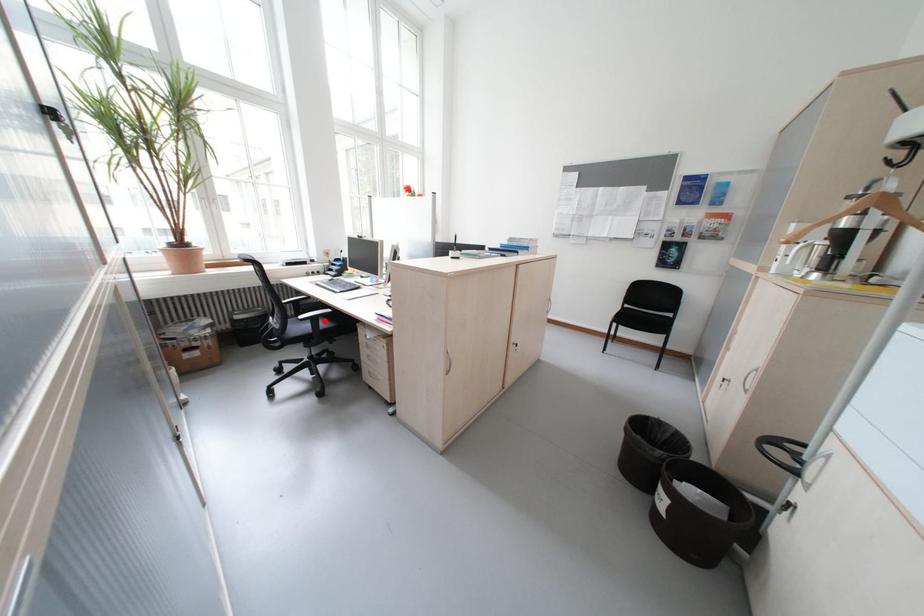
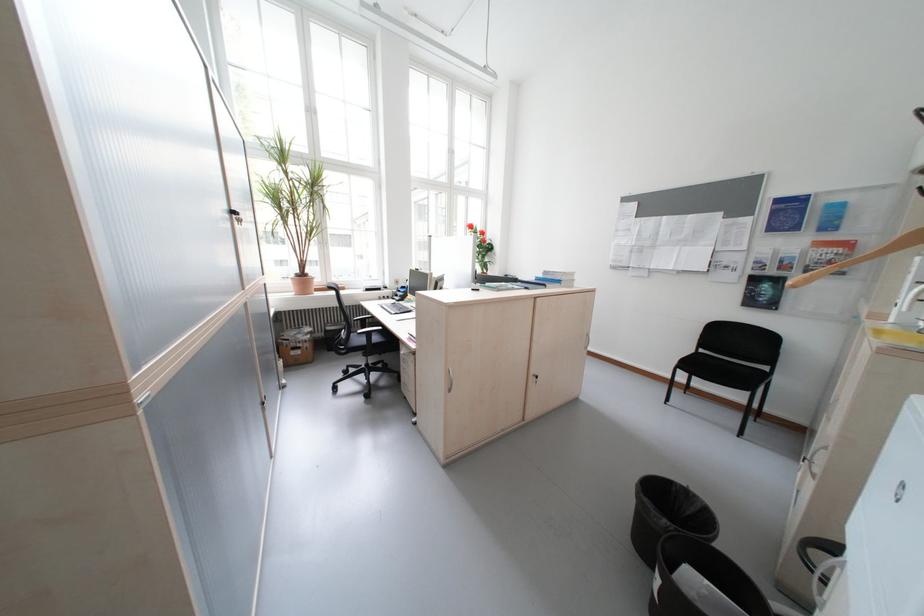
Question: A red point is marked in image1. In image2, is the corresponding 3D point closer to the camera or farther? Reply with the corresponding letter.

Choices:
 (A) The corresponding 3D point is closer.
 (B) The corresponding 3D point is farther.

Answer: (B)